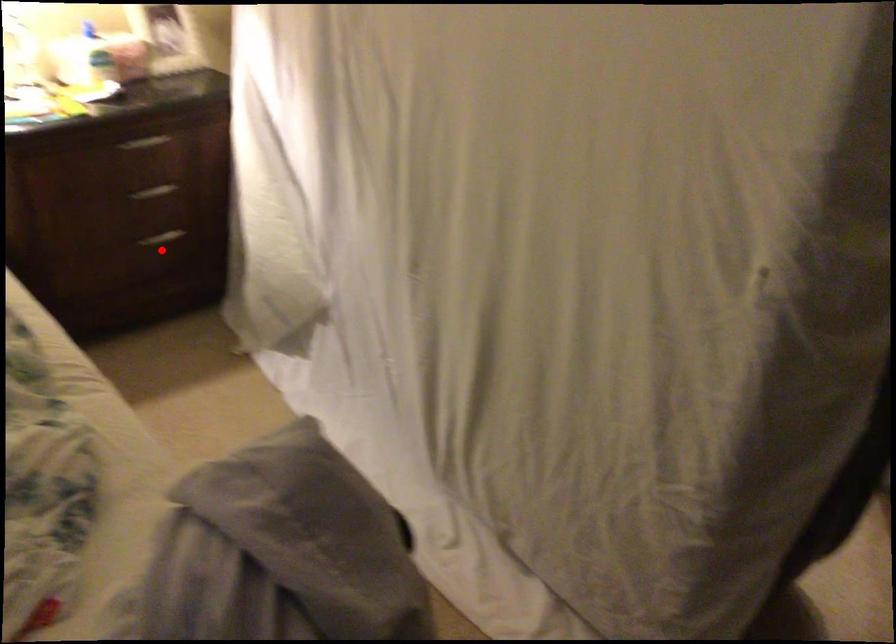
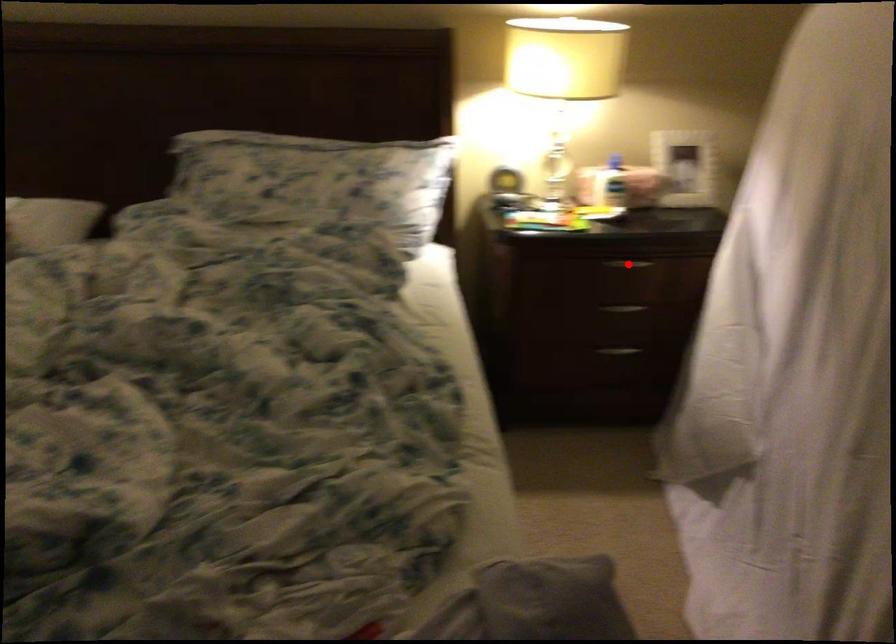
I am providing you with two images of the same scene from different viewpoints. A red point is marked on the first image and another point is marked on the second image. Does the point marked in image1 correspond to the same location as the one in image2?

No